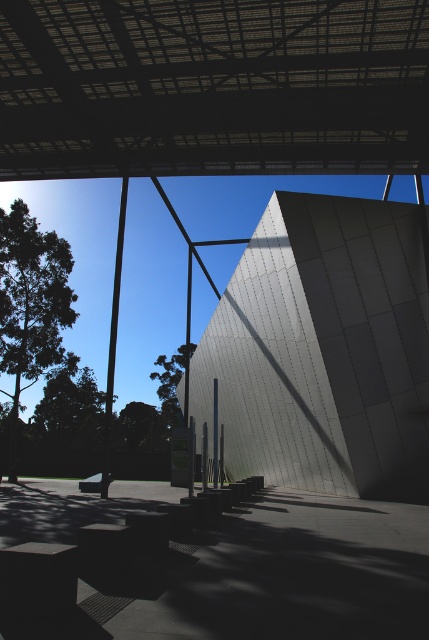
Can you confirm if green leafy tree at left is wider than green leafy tree at center?

Correct, the width of green leafy tree at left exceeds that of green leafy tree at center.

Who is lower down, green leafy tree at left or green leafy tree at center?

green leafy tree at center

Who is more distant from viewer, (48, 339) or (166, 397)?

The point (166, 397) is more distant.

The width and height of the screenshot is (429, 640). Find the location of `green leafy tree at left`. green leafy tree at left is located at coordinates (30, 305).

Who is shorter, metallic grid canopy at upper center or green leafy tree at center?

With less height is metallic grid canopy at upper center.

Does metallic grid canopy at upper center have a lesser width compared to green leafy tree at center?

In fact, metallic grid canopy at upper center might be wider than green leafy tree at center.

Find the location of a particular element. The width and height of the screenshot is (429, 640). metallic grid canopy at upper center is located at coordinates (213, 88).

Can you confirm if smooth gray wall at center is positioned to the left of green leafy tree at left?

No, smooth gray wall at center is not to the left of green leafy tree at left.

Does point (253, 461) come closer to viewer compared to point (5, 224)?

Yes, it is.

The width and height of the screenshot is (429, 640). I want to click on smooth gray wall at center, so point(323,349).